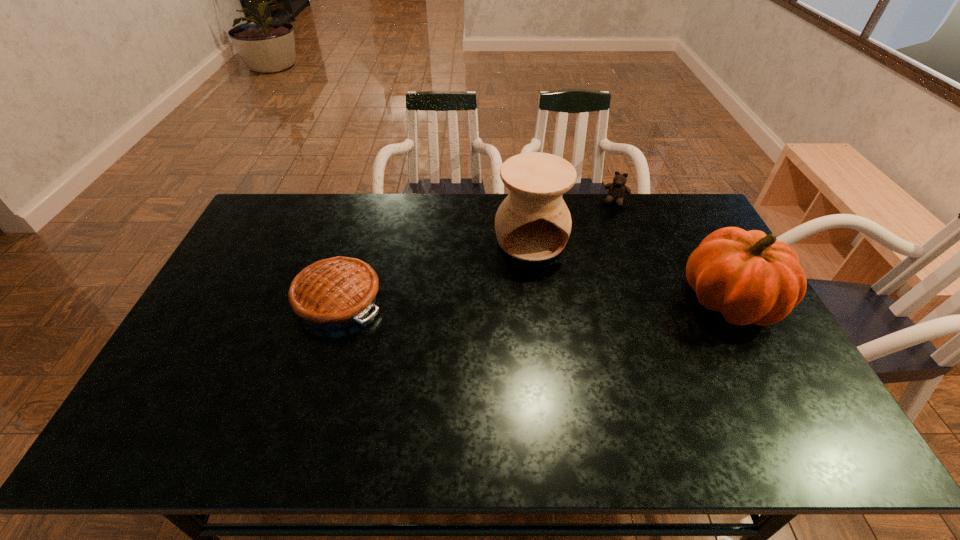
At what (x,y) coordinates should I click in order to perform the action: click on free space at the right edge of the desktop. Please return your answer as a coordinate pair (x, y). This screenshot has height=540, width=960. Looking at the image, I should click on (717, 312).

Where is `free region at the near left corner of the desktop`? This screenshot has width=960, height=540. free region at the near left corner of the desktop is located at coordinates (222, 376).

Where is `vacant space at the far right corner of the desktop`? The height and width of the screenshot is (540, 960). vacant space at the far right corner of the desktop is located at coordinates (701, 232).

At what (x,y) coordinates should I click in order to perform the action: click on vacant space that is in between the rightmost object and the teddy bear. Please return your answer as a coordinate pair (x, y). The height and width of the screenshot is (540, 960). Looking at the image, I should click on (673, 251).

Where is `vacant area that lies between the leftmost object and the pottery`? vacant area that lies between the leftmost object and the pottery is located at coordinates (435, 269).

Image resolution: width=960 pixels, height=540 pixels. I want to click on vacant region between the leftmost object and the pottery, so click(x=435, y=269).

Image resolution: width=960 pixels, height=540 pixels. What are the coordinates of `free space between the farthest object and the pumpkin` in the screenshot? It's located at (673, 251).

Identify the location of vacant area that lies between the rightmost object and the leftmost object. The image size is (960, 540). (534, 300).

Where is `free point between the second object from left to right and the rightmost object`? This screenshot has width=960, height=540. free point between the second object from left to right and the rightmost object is located at coordinates (631, 269).

Where is `vacant space that's between the second farthest object and the pumpkin`? The height and width of the screenshot is (540, 960). vacant space that's between the second farthest object and the pumpkin is located at coordinates (631, 269).